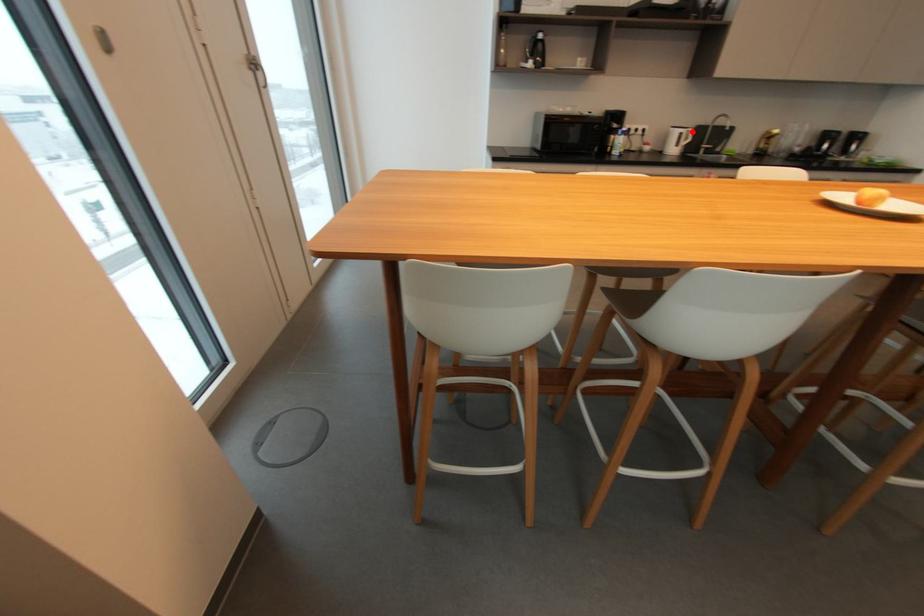
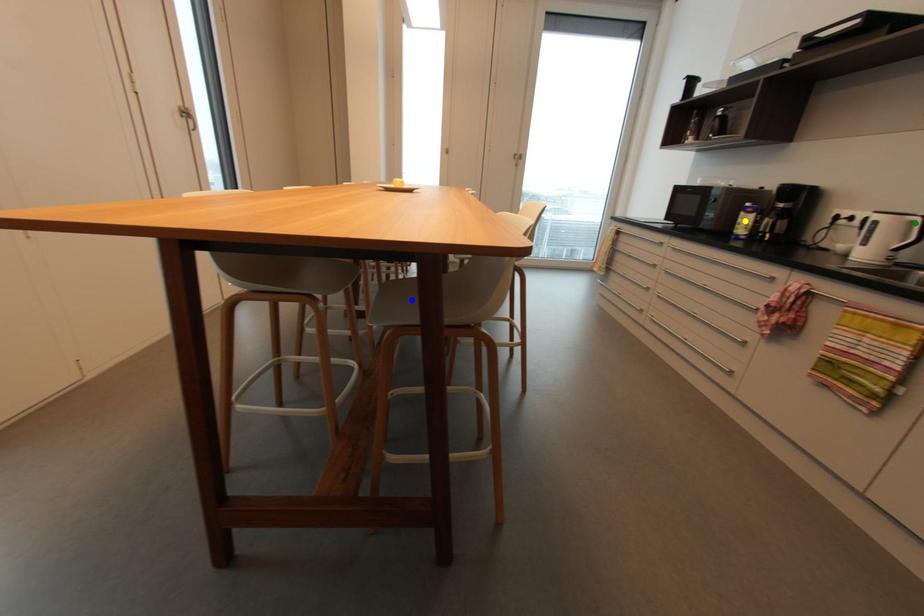
Question: I am providing you with two images of the same scene from different viewpoints. A red point is marked on the first image. You are given multiple points on the second image. Which point in image 2 represents the same 3d spot as the red point in image 1?

Choices:
 (A) yellow point
 (B) blue point
 (C) green point

Answer: (C)